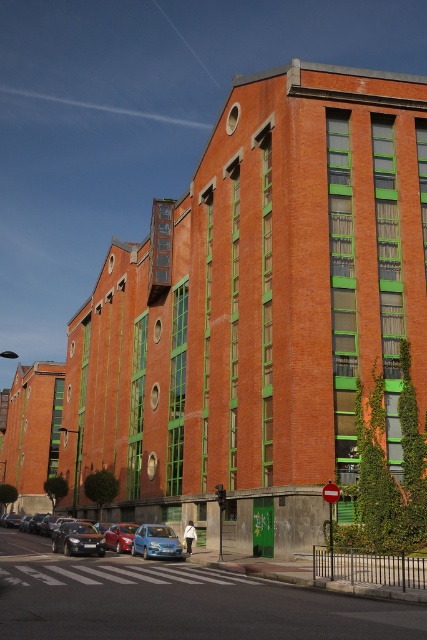
Question: In this image, where is shiny silver sedan at lower left located relative to metallic blue hatchback at center?

Choices:
 (A) above
 (B) below

Answer: (B)

Question: Estimate the real-world distances between objects in this image. Which object is closer to the metallic blue hatchback at center?

Choices:
 (A) metallic blue sedan at center
 (B) shiny silver sedan at lower left

Answer: (B)

Question: Does matte blue car at center appear on the left side of metallic blue hatchback at center?

Choices:
 (A) no
 (B) yes

Answer: (B)

Question: Estimate the real-world distances between objects in this image. Which object is closer to the matte blue car at center?

Choices:
 (A) metallic blue hatchback at center
 (B) metallic blue sedan at center
 (C) shiny silver sedan at lower left

Answer: (C)

Question: Does metallic blue hatchback at center appear under metallic blue sedan at center?

Choices:
 (A) yes
 (B) no

Answer: (B)

Question: Which of the following is the farthest from the observer?

Choices:
 (A) shiny silver sedan at lower left
 (B) metallic blue sedan at center

Answer: (B)